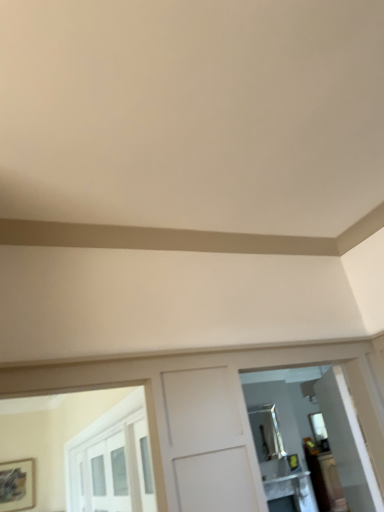
Locate an element on the screen. matte black picture frame at lower left is located at coordinates (17, 485).

In order to face white glossy table at lower right, should I rotate leftwards or rightwards?

Turn right by 12.807 degrees to look at white glossy table at lower right.

At what (x,y) coordinates should I click in order to perform the action: click on matte black picture frame at lower left. Please return your answer as a coordinate pair (x, y). The height and width of the screenshot is (512, 384). Looking at the image, I should click on (17, 485).

Considering the positions of objects matte black picture frame at lower left and white glossy table at lower right in the image provided, who is in front, matte black picture frame at lower left or white glossy table at lower right?

Positioned in front is matte black picture frame at lower left.

Is matte black picture frame at lower left aimed at white glossy table at lower right?

No, matte black picture frame at lower left is not turned towards white glossy table at lower right.

From a real-world perspective, is matte black picture frame at lower left physically above white glossy table at lower right?

Indeed, from a real-world perspective, matte black picture frame at lower left stands above white glossy table at lower right.

From the image's perspective, would you say matte black picture frame at lower left is shown under white glossy table at lower right?

No, from the image's perspective, matte black picture frame at lower left is not below white glossy table at lower right.

Does silver metallic mirror at upper center, the first mirror in the back-to-front sequence, have a greater width compared to matte black picture frame at lower left?

In fact, silver metallic mirror at upper center, the first mirror in the back-to-front sequence, might be narrower than matte black picture frame at lower left.

Does silver metallic mirror at upper center, the second mirror positioned from the top, contain matte black picture frame at lower left?

No.

From a real-world perspective, between silver metallic mirror at upper center, the second mirror positioned from the top, and matte black picture frame at lower left, who is vertically lower?

In real-world perspective, matte black picture frame at lower left is lower.

Can you tell me how much silver metallic mirror at upper center, the first mirror in the back-to-front sequence, and matte black picture frame at lower left differ in facing direction?

They differ by 0.791 degrees in their facing directions.

Is matte black picture frame at lower left with matte silver mirror at right, the first mirror when ordered from front to back?

They are not placed beside each other.

Is matte black picture frame at lower left outside of matte silver mirror at right, placed as the 1th mirror when sorted from top to bottom?

Absolutely, matte black picture frame at lower left is external to matte silver mirror at right, placed as the 1th mirror when sorted from top to bottom.

Based on the photo, is matte black picture frame at lower left in front of or behind matte silver mirror at right, the 2th mirror in the bottom-to-top sequence, in the image?

matte black picture frame at lower left is positioned farther from the viewer than matte silver mirror at right, the 2th mirror in the bottom-to-top sequence.

What's the angular difference between matte black picture frame at lower left and matte silver mirror at right, the 2th mirror in the bottom-to-top sequence,'s facing directions?

The angle between the facing direction of matte black picture frame at lower left and the facing direction of matte silver mirror at right, the 2th mirror in the bottom-to-top sequence, is 120 degrees.

Would you consider matte silver mirror at right, the 2th mirror in the bottom-to-top sequence, to be distant from white glossy table at lower right?

No, matte silver mirror at right, the 2th mirror in the bottom-to-top sequence, is not far away from white glossy table at lower right.

From a real-world perspective, is matte silver mirror at right, placed as the 1th mirror when sorted from top to bottom, on top of white glossy table at lower right?

Yes, from a real-world perspective, matte silver mirror at right, placed as the 1th mirror when sorted from top to bottom, is on top of white glossy table at lower right.

Based on the photo, could you measure the distance between matte silver mirror at right, placed as the second mirror when sorted from back to front, and white glossy table at lower right?

They are 36.70 inches apart.

Between matte silver mirror at right, placed as the second mirror when sorted from back to front, and white glossy table at lower right, which one appears on the left side from the viewer's perspective?

matte silver mirror at right, placed as the second mirror when sorted from back to front.

Considering the points (303, 510) and (11, 466), which point is in front, point (303, 510) or point (11, 466)?

The point (303, 510) is closer.

In the scene shown: Is white glossy table at lower right inside or outside of matte black picture frame at lower left?

white glossy table at lower right is not inside matte black picture frame at lower left, it's outside.

Based on the photo, between white glossy table at lower right and matte black picture frame at lower left, which one has larger width?

Wider between the two is white glossy table at lower right.

The height and width of the screenshot is (512, 384). Find the location of `picture frame above the white glossy table at lower right (from the image's perspective)`. picture frame above the white glossy table at lower right (from the image's perspective) is located at coordinates (17, 485).

Which point is more distant from viewer, (x=290, y=482) or (x=282, y=383)?

Positioned behind is point (x=282, y=383).

In the scene shown: Is white glossy table at lower right wider or thinner than matte silver mirror at right, the first mirror when ordered from front to back?

white glossy table at lower right is wider than matte silver mirror at right, the first mirror when ordered from front to back.

Looking at this image, is matte silver mirror at right, placed as the second mirror when sorted from back to front, at the back of white glossy table at lower right?

white glossy table at lower right is not turned away from matte silver mirror at right, placed as the second mirror when sorted from back to front.

I want to click on mirror below the silver metallic mirror at upper center, which is the second mirror from front to back (from a real-world perspective), so click(312, 436).

From a real-world perspective, is silver metallic mirror at upper center, which is the 1th mirror from bottom to top, positioned over matte silver mirror at right, the first mirror when ordered from front to back, based on gravity?

Yes.

Between silver metallic mirror at upper center, which is the second mirror from front to back, and matte silver mirror at right, placed as the 1th mirror when sorted from top to bottom, which one has smaller width?

silver metallic mirror at upper center, which is the second mirror from front to back, is thinner.

Based on their sizes in the image, would you say silver metallic mirror at upper center, which is the 1th mirror from bottom to top, is bigger or smaller than matte silver mirror at right, the first mirror when ordered from front to back?

silver metallic mirror at upper center, which is the 1th mirror from bottom to top, is smaller than matte silver mirror at right, the first mirror when ordered from front to back.

Where is `table behind the matte black picture frame at lower left`? The height and width of the screenshot is (512, 384). table behind the matte black picture frame at lower left is located at coordinates (292, 490).

At what (x,y) coordinates should I click in order to perform the action: click on picture frame on the left of silver metallic mirror at upper center, which is the 1th mirror from bottom to top. Please return your answer as a coordinate pair (x, y). This screenshot has width=384, height=512. Looking at the image, I should click on [17, 485].

From the image, which object appears to be farther from silver metallic mirror at upper center, which is the 1th mirror from bottom to top, matte silver mirror at right, the 2th mirror in the bottom-to-top sequence, or matte black picture frame at lower left?

matte black picture frame at lower left lies further to silver metallic mirror at upper center, which is the 1th mirror from bottom to top, than the other object.

From the image, which object appears to be nearer to white glossy table at lower right, silver metallic mirror at upper center, which is the second mirror from front to back, or matte black picture frame at lower left?

silver metallic mirror at upper center, which is the second mirror from front to back, is closer to white glossy table at lower right.

Estimate the real-world distances between objects in this image. Which object is closer to matte black picture frame at lower left, white glossy table at lower right or matte silver mirror at right, placed as the second mirror when sorted from back to front?

Among the two, white glossy table at lower right is located nearer to matte black picture frame at lower left.

Considering their positions, is matte silver mirror at right, placed as the 1th mirror when sorted from top to bottom, positioned closer to white glossy table at lower right than matte black picture frame at lower left?

Based on the image, matte silver mirror at right, placed as the 1th mirror when sorted from top to bottom, appears to be nearer to white glossy table at lower right.

When comparing their distances from white glossy table at lower right, does matte black picture frame at lower left or silver metallic mirror at upper center, the first mirror in the back-to-front sequence, seem further?

The object further to white glossy table at lower right is matte black picture frame at lower left.

Estimate the real-world distances between objects in this image. Which object is closer to white glossy table at lower right, silver metallic mirror at upper center, the first mirror in the back-to-front sequence, or matte silver mirror at right, placed as the 1th mirror when sorted from top to bottom?

Among the two, silver metallic mirror at upper center, the first mirror in the back-to-front sequence, is located nearer to white glossy table at lower right.

Consider the image. Considering their positions, is matte black picture frame at lower left positioned closer to matte silver mirror at right, the 2th mirror in the bottom-to-top sequence, than white glossy table at lower right?

white glossy table at lower right is positioned closer to the anchor matte silver mirror at right, the 2th mirror in the bottom-to-top sequence.

Based on their spatial positions, is matte silver mirror at right, the 2th mirror in the bottom-to-top sequence, or white glossy table at lower right further from matte black picture frame at lower left?

Based on the image, matte silver mirror at right, the 2th mirror in the bottom-to-top sequence, appears to be further to matte black picture frame at lower left.

Identify the location of table between matte silver mirror at right, placed as the second mirror when sorted from back to front, and silver metallic mirror at upper center, which is the 1th mirror from bottom to top, in the front-back direction. (292, 490).

The height and width of the screenshot is (512, 384). In order to click on picture frame between matte silver mirror at right, placed as the 1th mirror when sorted from top to bottom, and silver metallic mirror at upper center, which is the 1th mirror from bottom to top, along the z-axis in this screenshot , I will do `click(17, 485)`.